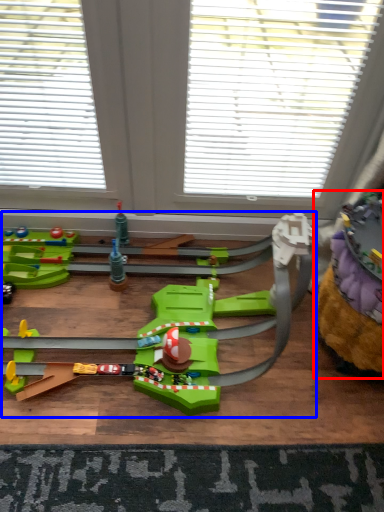
Question: Which of the following is the closest to the observer, toy (highlighted by a red box) or toy (highlighted by a blue box)?

Choices:
 (A) toy
 (B) toy

Answer: (B)